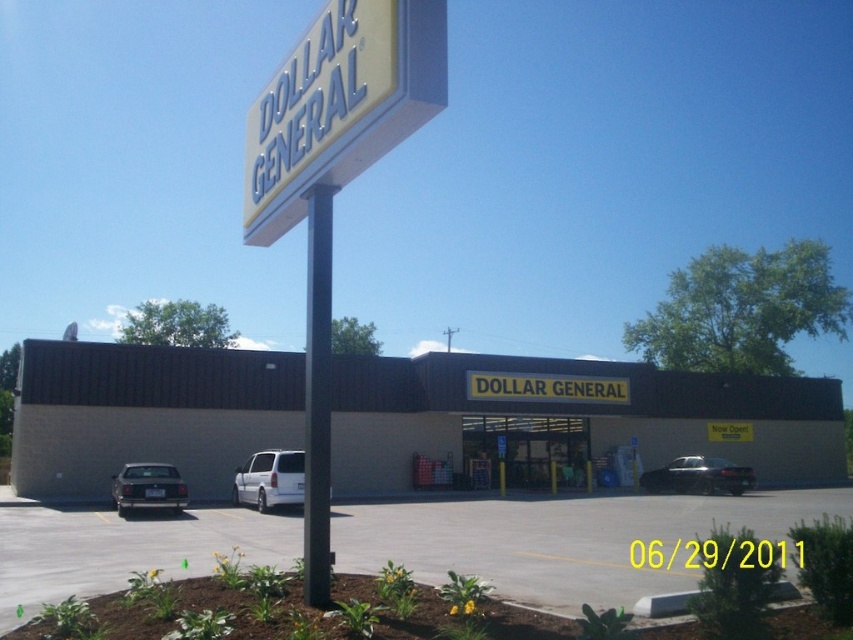
You are standing in the parking lot of the Dollar General store. You see the beige concrete building at center and the white matte van at center. Which object is positioned to the right of the other?

The beige concrete building at center is to the right of the white matte van at center.

You are a delivery driver who needs to park your truck in the gray asphalt parking lot at center. Your truck is 2 meters wide. Can you fit your truck into the parking space next to the black smooth pole at center?

The gray asphalt parking lot at center is wider than the black smooth pole at center. Since the parking lot is wider, your truck which is 2 meters wide can fit into the parking space next to the black smooth pole at center.

You are standing in the parking lot of the Dollar General store. You see the beige concrete building at center and the matte black sedan at lower left. Which object is positioned higher from the ground?

The matte black sedan at lower left is positioned higher from the ground than the beige concrete building at center because the beige concrete building at center is located below it.